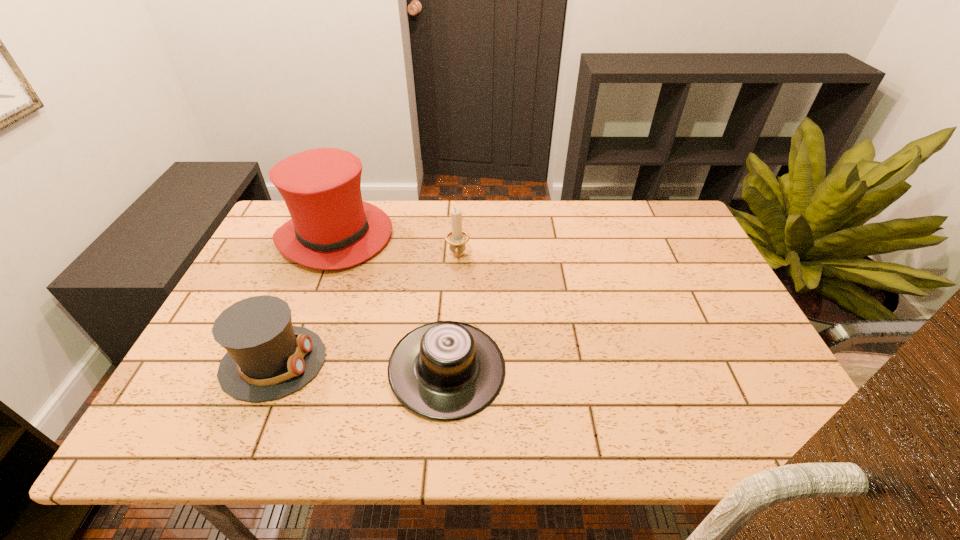
You are a GUI agent. You are given a task and a screenshot of the screen. Output one action in this format:
    pyautogui.click(x=<x>, y=<y>)
    Task: Click on the tallest dress hat
    This screenshot has height=540, width=960.
    Given the screenshot: What is the action you would take?
    pyautogui.click(x=331, y=228)

This screenshot has width=960, height=540. In order to click on the tallest object in this screenshot , I will do `click(331, 228)`.

You are a GUI agent. You are given a task and a screenshot of the screen. Output one action in this format:
    pyautogui.click(x=<x>, y=<y>)
    Task: Click on the candle_holder
    The height and width of the screenshot is (540, 960).
    Given the screenshot: What is the action you would take?
    pyautogui.click(x=457, y=238)

In order to click on the second shortest dress hat in this screenshot , I will do `click(267, 358)`.

The width and height of the screenshot is (960, 540). In order to click on the shortest dress hat in this screenshot , I will do `click(446, 370)`.

The width and height of the screenshot is (960, 540). Identify the location of the shortest object. (446, 370).

Locate an element on the screen. This screenshot has height=540, width=960. vacant space located on the right of the tallest object is located at coordinates (476, 237).

The width and height of the screenshot is (960, 540). I want to click on free location located 0.380m on the handle side of the candle_holder, so click(451, 379).

Find the location of a particular element. The width and height of the screenshot is (960, 540). vacant region located with goggles on the front of the second tallest dress hat is located at coordinates (454, 362).

Where is `free space located on the right of the shortest object`? Image resolution: width=960 pixels, height=540 pixels. free space located on the right of the shortest object is located at coordinates (566, 369).